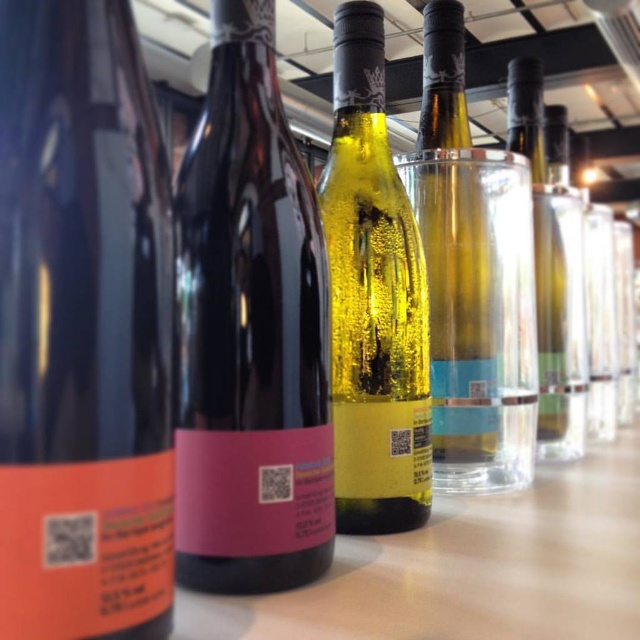
You are a bartender preparing a drink and need to place a 12 inch long bottle between the shiny black bottle at center and the translucent glass bottle at center. Can you fit it there?

The distance between the shiny black bottle at center and the translucent glass bottle at center is 12.18 inches, so yes, the 12 inch long bottle can fit between them since there is enough space.

You are a bartender preparing a drink and need to choose between the matte black bottle at center and the clear glass bottle at right. Based on their heights, which one is shorter?

The matte black bottle at center is shorter than the clear glass bottle at right.

You are a bartender preparing a drink and need to grab a bottle. You see the matte black bottle at center and the clear glass bottle at right. Which bottle is located to the right of the other?

The clear glass bottle at right is located to the right of the matte black bottle at center because the matte black bottle at center is positioned on the left side of clear glass bottle at right.